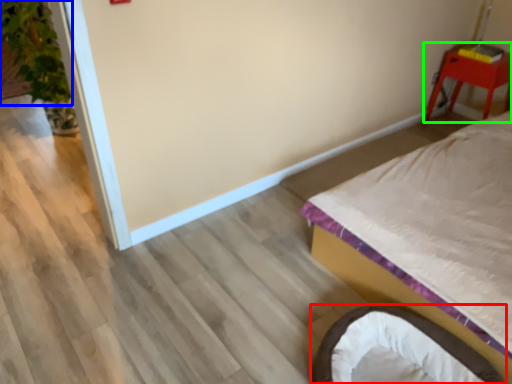
Question: Considering the real-world distances, which object is closest to infant bed (highlighted by a red box)? plant (highlighted by a blue box) or furniture (highlighted by a green box).

Choices:
 (A) plant
 (B) furniture

Answer: (B)